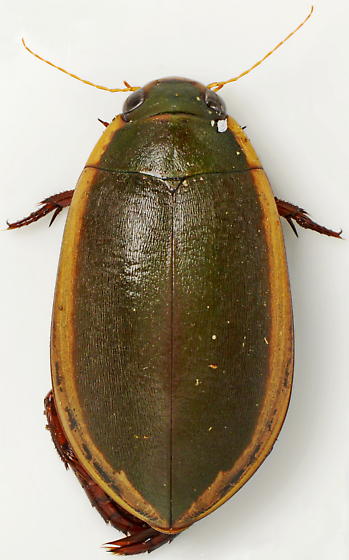
Where is `wall`? wall is located at coordinates coord(308,490).